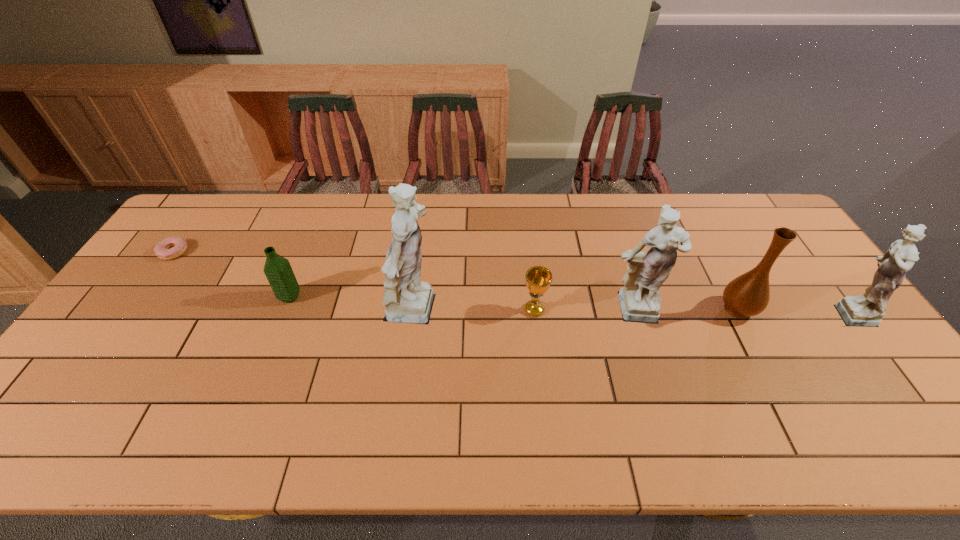
The width and height of the screenshot is (960, 540). Find the location of `blank region between the shortest figurine and the fourth object from right to left`. blank region between the shortest figurine and the fourth object from right to left is located at coordinates (691, 311).

I want to click on free area in between the doughnut and the vase, so click(x=456, y=280).

At what (x,y) coordinates should I click in order to perform the action: click on the fourth closest object to the leftmost figurine. Please return your answer as a coordinate pair (x, y). Looking at the image, I should click on (178, 246).

The height and width of the screenshot is (540, 960). In order to click on the sixth closest object to the sixth object from right to left in this screenshot , I will do `click(867, 310)`.

Point out which figurine is positioned as the nearest to the third object from left to right. Please provide its 2D coordinates. Your answer should be formatted as a tuple, i.e. [(x, y)], where the tuple contains the x and y coordinates of a point satisfying the conditions above.

[(639, 299)]

Find the location of `figurine that is the second nearest to the fifth object from left to right`. figurine that is the second nearest to the fifth object from left to right is located at coordinates (867, 310).

Locate an element on the screen. Image resolution: width=960 pixels, height=540 pixels. free region that satisfies the following two spatial constraints: 1. on the front-facing side of the second tallest figurine; 2. on the front-facing side of the third object from left to right is located at coordinates (633, 314).